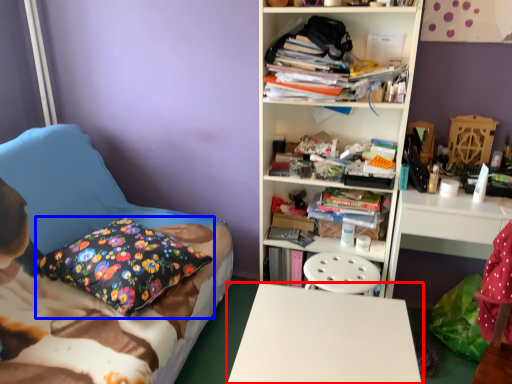
Question: Which object appears farthest to the camera in this image, desk (highlighted by a red box) or pillow (highlighted by a blue box)?

Choices:
 (A) desk
 (B) pillow

Answer: (B)